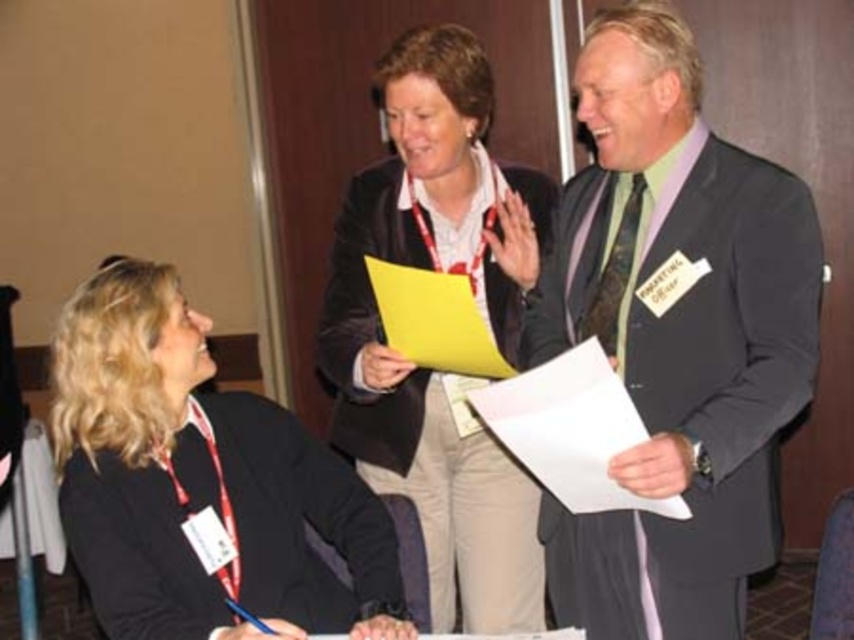
Question: Is dark gray suit at center below matte black jacket at center?

Choices:
 (A) no
 (B) yes

Answer: (A)

Question: From the image, what is the correct spatial relationship of dark gray suit at center in relation to black matte jacket at lower left?

Choices:
 (A) left
 (B) right

Answer: (B)

Question: Which point is closer to the camera?

Choices:
 (A) (133, 628)
 (B) (762, 566)

Answer: (A)

Question: Which object is the closest to the matte black jacket at center?

Choices:
 (A) dark gray suit at center
 (B) black matte jacket at lower left

Answer: (A)

Question: Which point appears closest to the camera in this image?

Choices:
 (A) (295, 611)
 (B) (453, 154)
 (C) (718, 636)

Answer: (A)

Question: Can you confirm if dark gray suit at center is bigger than black matte jacket at lower left?

Choices:
 (A) yes
 (B) no

Answer: (B)